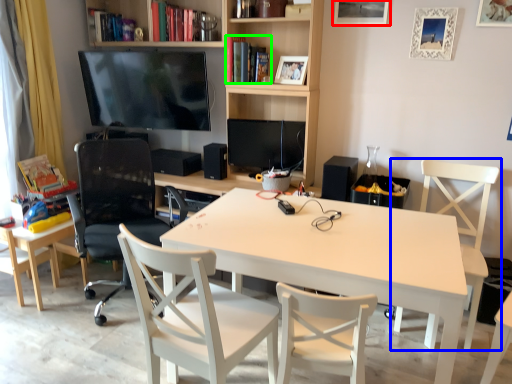
Question: Which object is positioned closest to picture frame (highlighted by a red box)? Select from chair (highlighted by a blue box) and book (highlighted by a green box).

Choices:
 (A) chair
 (B) book

Answer: (B)